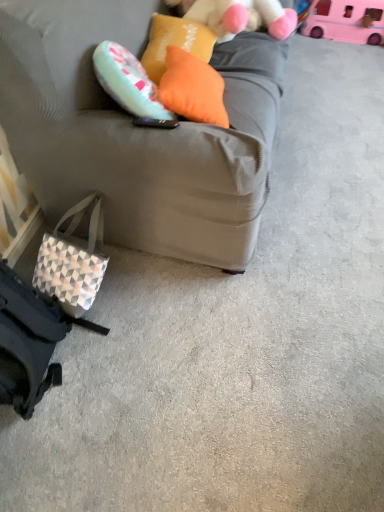
At what (x,y) coordinates should I click in order to perform the action: click on free space on the front side of matte gray couch at center. Please return your answer as a coordinate pair (x, y). This screenshot has height=512, width=384. Looking at the image, I should click on (241, 347).